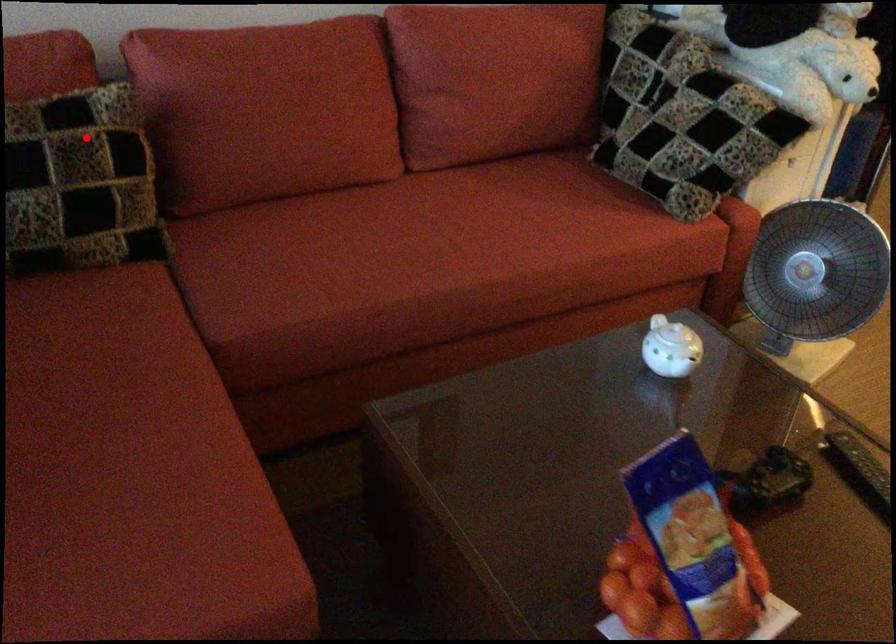
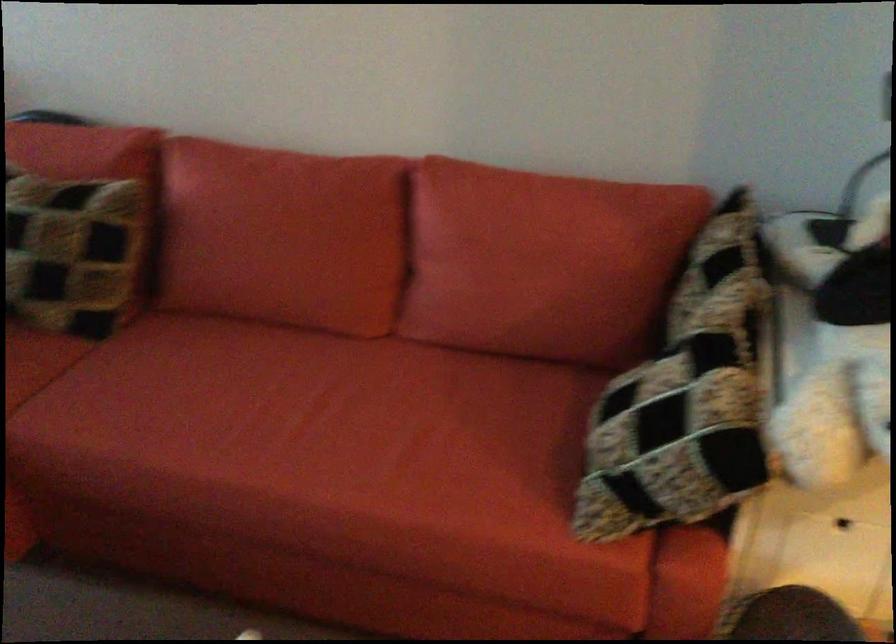
Question: I am providing you with two images of the same scene from different viewpoints. In image1, a red point is highlighted. Considering the same 3D point in image2, which of the following is correct?

Choices:
 (A) It is closer
 (B) It is farther

Answer: (B)